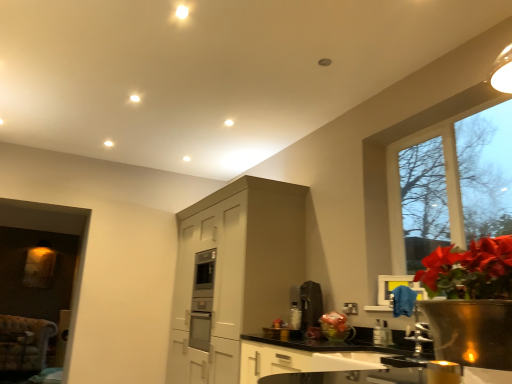
Question: From a real-world perspective, is translucent plastic vase at lower center over matte gray cabinet at center?

Choices:
 (A) no
 (B) yes

Answer: (A)

Question: Is matte gray cabinet at center surrounded by translucent plastic vase at lower center?

Choices:
 (A) yes
 (B) no

Answer: (B)

Question: From a real-world perspective, is translucent plastic vase at lower center beneath matte gray cabinet at center?

Choices:
 (A) yes
 (B) no

Answer: (A)

Question: From the image's perspective, is translucent plastic vase at lower center on top of matte gray cabinet at center?

Choices:
 (A) no
 (B) yes

Answer: (B)

Question: Is translucent plastic vase at lower center outside matte gray cabinet at center?

Choices:
 (A) no
 (B) yes

Answer: (B)

Question: In terms of height, does white glossy sink at lower center look taller or shorter compared to satin black coffee maker at center?

Choices:
 (A) short
 (B) tall

Answer: (A)

Question: Considering the positions of point (403, 370) and point (315, 307), is point (403, 370) closer or farther from the camera than point (315, 307)?

Choices:
 (A) closer
 (B) farther

Answer: (A)

Question: Relative to satin black coffee maker at center, is white glossy sink at lower center in front or behind?

Choices:
 (A) behind
 (B) front

Answer: (B)

Question: From a real-world perspective, is white glossy sink at lower center physically located above or below satin black coffee maker at center?

Choices:
 (A) above
 (B) below

Answer: (B)

Question: Is translucent plastic vase at lower center inside or outside of satin black coffee maker at center?

Choices:
 (A) inside
 (B) outside

Answer: (B)

Question: From their relative heights in the image, would you say translucent plastic vase at lower center is taller or shorter than satin black coffee maker at center?

Choices:
 (A) short
 (B) tall

Answer: (A)

Question: Relative to satin black coffee maker at center, is translucent plastic vase at lower center in front or behind?

Choices:
 (A) behind
 (B) front

Answer: (B)

Question: From a real-world perspective, relative to satin black coffee maker at center, is translucent plastic vase at lower center vertically above or below?

Choices:
 (A) above
 (B) below

Answer: (B)

Question: Considering their positions, is clear glass window at upper right located in front of or behind satin black coffee maker at center?

Choices:
 (A) behind
 (B) front

Answer: (B)

Question: From a real-world perspective, is clear glass window at upper right positioned above or below satin black coffee maker at center?

Choices:
 (A) below
 (B) above

Answer: (B)